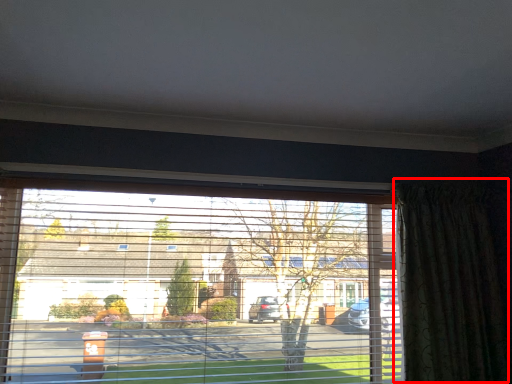
Question: Observing the image, what is the correct spatial positioning of curtain (annotated by the red box) in reference to window?

Choices:
 (A) left
 (B) right

Answer: (B)